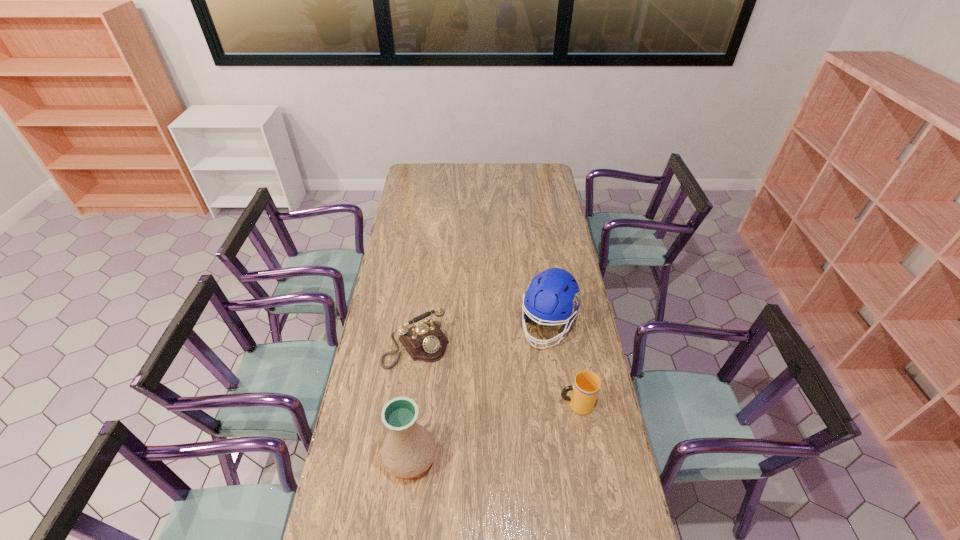
Where is `free space between the cup and the football helmet`? free space between the cup and the football helmet is located at coordinates (563, 365).

The image size is (960, 540). Identify the location of blank region between the cup and the telephone. (496, 375).

Where is `free area in between the cup and the nearest object`? The height and width of the screenshot is (540, 960). free area in between the cup and the nearest object is located at coordinates (493, 431).

Locate an element on the screen. The height and width of the screenshot is (540, 960). object that is the second closest to the third farthest object is located at coordinates (424, 341).

The width and height of the screenshot is (960, 540). I want to click on object that is the third closest to the third farthest object, so click(408, 451).

The height and width of the screenshot is (540, 960). Find the location of `free space that satisfies the following two spatial constraints: 1. on the back side of the football helmet; 2. on the right side of the nearest object`. free space that satisfies the following two spatial constraints: 1. on the back side of the football helmet; 2. on the right side of the nearest object is located at coordinates [x=425, y=326].

Image resolution: width=960 pixels, height=540 pixels. What are the coordinates of `vacant position in the image that satisfies the following two spatial constraints: 1. on the front side of the cup; 2. on the side of the telephone with the handle` in the screenshot? It's located at (409, 404).